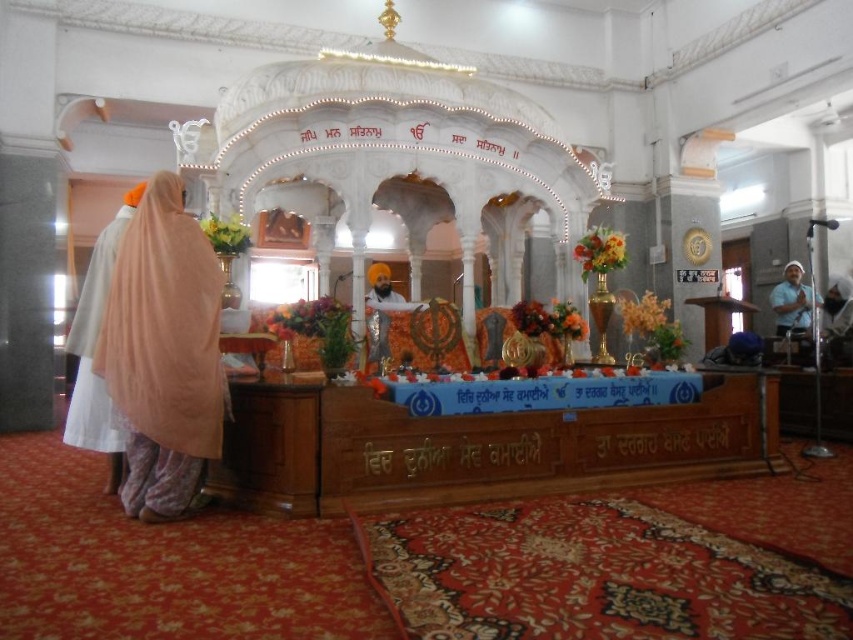
Question: Which of these objects is positioned farthest from the white silk robe at left?

Choices:
 (A) blue fabric at right
 (B) light peach sheer at left

Answer: (A)

Question: Which point is farther to the camera?

Choices:
 (A) white silk robe at left
 (B) light peach sheer at left
 (C) blue fabric at right

Answer: (C)

Question: Is light peach sheer at left in front of blue fabric at right?

Choices:
 (A) yes
 (B) no

Answer: (A)

Question: Considering the relative positions of white silk robe at left and blue fabric at right in the image provided, where is white silk robe at left located with respect to blue fabric at right?

Choices:
 (A) above
 (B) below

Answer: (B)

Question: Can you confirm if light peach sheer at left is positioned above blue fabric at right?

Choices:
 (A) yes
 (B) no

Answer: (B)

Question: Which object is closer to the camera taking this photo?

Choices:
 (A) light peach sheer at left
 (B) white silk robe at left
 (C) blue fabric at right

Answer: (A)